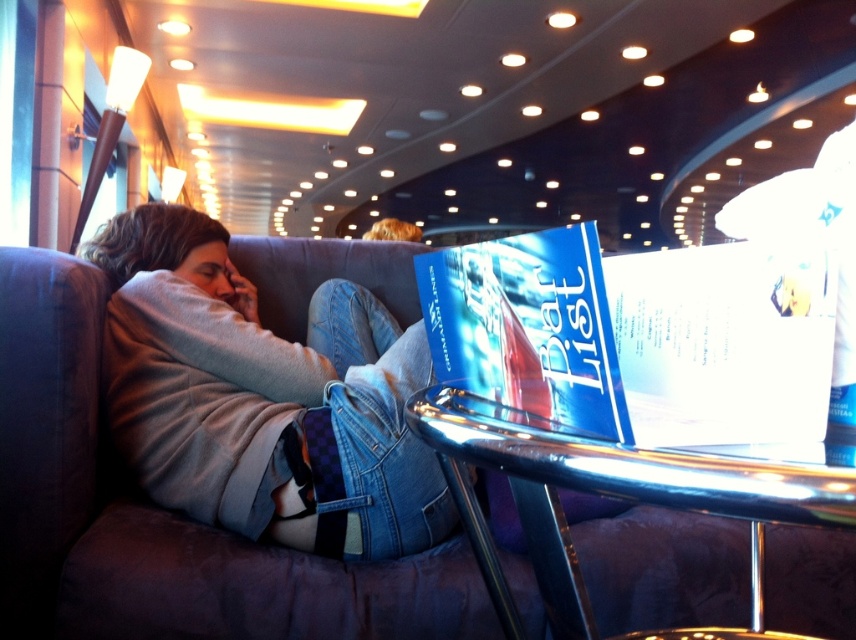
Question: Among these objects, which one is farthest from the camera?

Choices:
 (A) blue glossy book at center
 (B) shiny metallic table at lower center

Answer: (A)

Question: Does blue glossy book at center appear over shiny metallic table at lower center?

Choices:
 (A) no
 (B) yes

Answer: (B)

Question: Does blue glossy book at center appear on the right side of shiny metallic table at lower center?

Choices:
 (A) no
 (B) yes

Answer: (A)

Question: Which point is farther to the camera?

Choices:
 (A) pos(679,452)
 (B) pos(729,262)

Answer: (B)

Question: Which of the following is the farthest from the observer?

Choices:
 (A) (x=822, y=470)
 (B) (x=504, y=348)

Answer: (B)

Question: Is blue glossy book at center bigger than shiny metallic table at lower center?

Choices:
 (A) no
 (B) yes

Answer: (A)